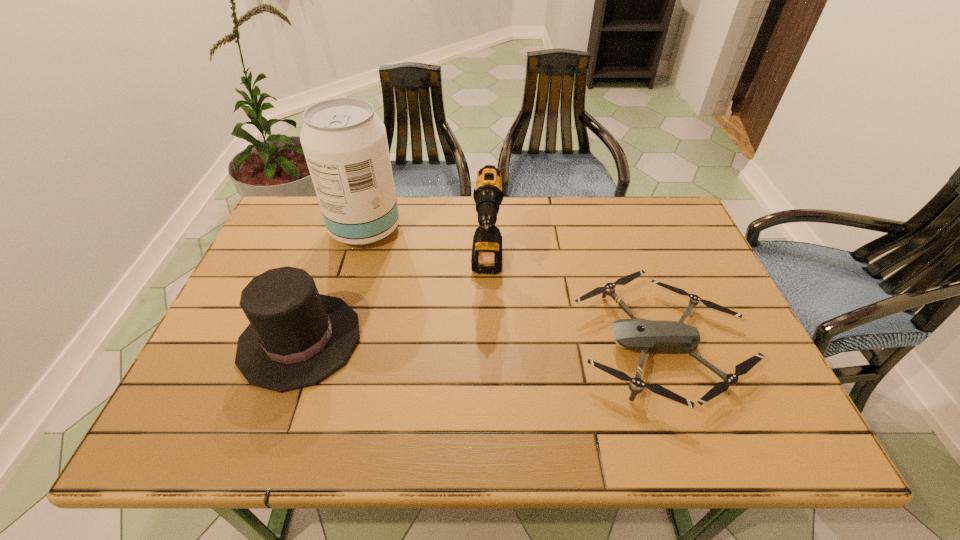
In order to click on vacant position at the left edge of the desktop in this screenshot , I will do `click(254, 276)`.

In the image, there is a desktop. Identify the location of vacant space at the right edge. The height and width of the screenshot is (540, 960). (709, 270).

In order to click on free space at the near right corner of the desktop in this screenshot , I will do `click(706, 411)`.

Locate an element on the screen. This screenshot has width=960, height=540. vacant space that is in between the drone and the third object from left to right is located at coordinates (574, 306).

Locate an element on the screen. free space between the third object from left to right and the tallest object is located at coordinates (426, 249).

You are a GUI agent. You are given a task and a screenshot of the screen. Output one action in this format:
    pyautogui.click(x=<x>, y=<y>)
    Task: Click on the unoccupied area between the tallest object and the third tallest object
    
    Given the screenshot: What is the action you would take?
    pyautogui.click(x=333, y=285)

Where is `free space between the drone and the tallest object`? This screenshot has height=540, width=960. free space between the drone and the tallest object is located at coordinates (514, 287).

Where is `unoccupied position between the second shortest object and the second tallest object`? unoccupied position between the second shortest object and the second tallest object is located at coordinates (394, 304).

Identify the location of blank region between the dress hat and the shortest object. The width and height of the screenshot is (960, 540). (481, 342).

The image size is (960, 540). In order to click on free space between the second object from right to left and the third tallest object in this screenshot , I will do `click(394, 304)`.